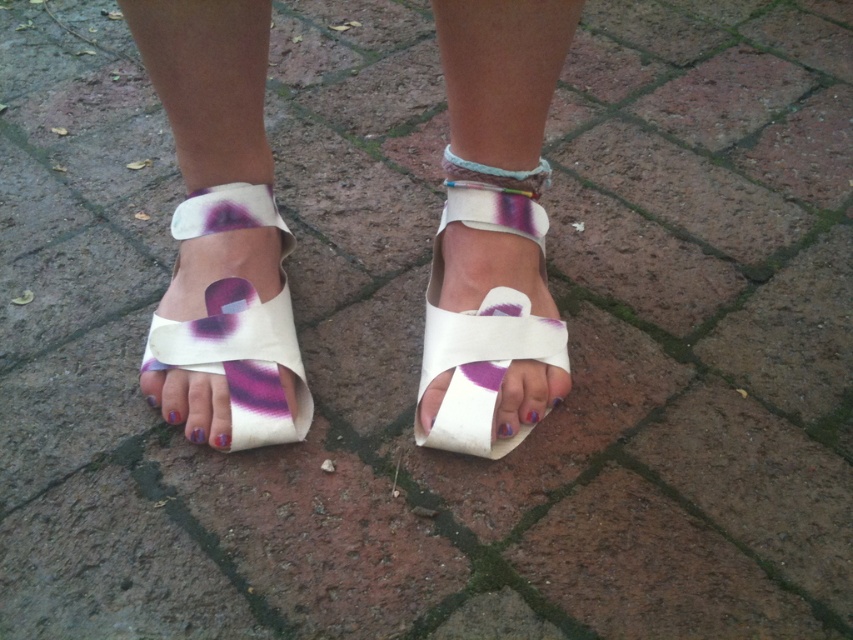
You are a photographer trying to capture the white leather sandals at center and the white leather sandal at lower left in a single frame. Based on their positions, which sandal should you focus on first to ensure both are in the shot?

The white leather sandals at center are to the right of the white leather sandal at lower left. Therefore, focusing on the white leather sandal at lower left first will help ensure both are captured in the frame since it is positioned further left.

You are a shoe designer observing the image. You need to decide which sandal to recommend for a client who prefers a more substantial size. Which one would you choose between the white leather sandals at center and the white leather sandal at lower left?

The white leather sandals at center is larger in size than the white leather sandal at lower left, so you should recommend the white leather sandals at center for a more substantial size.

You are a photographer trying to capture the multicolored woven bracelet at center and the white leather sandals at center in a single shot. Since both are at the center, which one is closer to the camera?

The multicolored woven bracelet at center is closer to the camera than the white leather sandals at center because the white leather sandals at center is positioned under the multicolored woven bracelet at center.